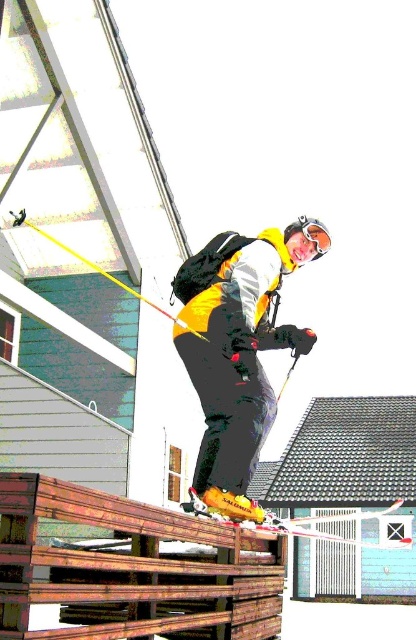
From the picture: Is rusty wood rail at center smaller than yellow metallic ski at center?

Yes, rusty wood rail at center is smaller than yellow metallic ski at center.

The image size is (416, 640). What do you see at coordinates (133, 566) in the screenshot?
I see `rusty wood rail at center` at bounding box center [133, 566].

In order to click on rusty wood rail at center in this screenshot , I will do [133, 566].

Which is below, rusty wood rail at center or translucent orange goggles at upper center?

rusty wood rail at center

Is point (5, 563) closer to camera compared to point (307, 221)?

Yes, point (5, 563) is in front of point (307, 221).

The height and width of the screenshot is (640, 416). I want to click on rusty wood rail at center, so click(x=133, y=566).

Where is `rusty wood rail at center`? rusty wood rail at center is located at coordinates (133, 566).

In the scene shown: Can you confirm if yellow plastic ski pole at upper center is positioned to the right of translucent orange goggles at upper center?

Incorrect, yellow plastic ski pole at upper center is not on the right side of translucent orange goggles at upper center.

Can you confirm if yellow plastic ski pole at upper center is thinner than translucent orange goggles at upper center?

No.

Locate an element on the screen. This screenshot has height=640, width=416. yellow plastic ski pole at upper center is located at coordinates point(99,269).